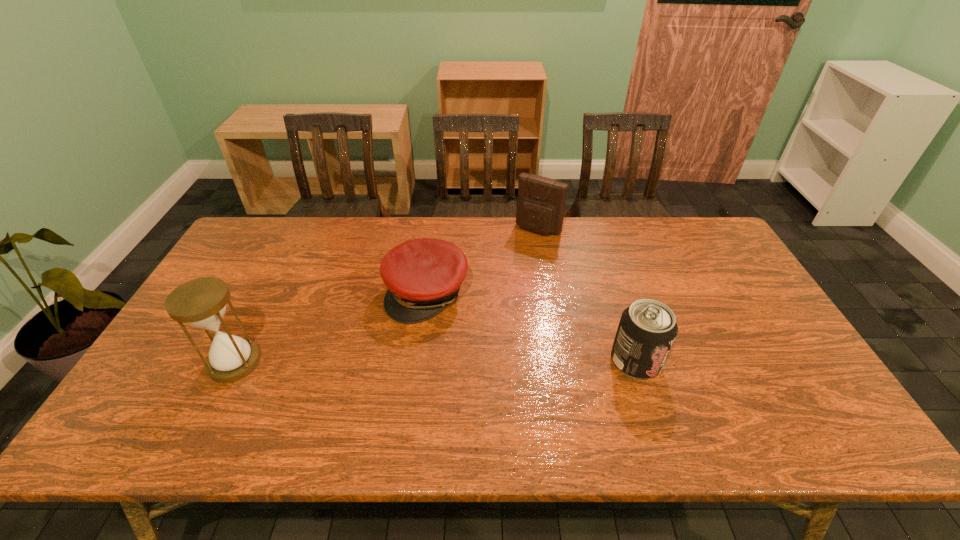
This screenshot has width=960, height=540. What are the coordinates of `vacant area that lies between the soda can and the tallest object` in the screenshot? It's located at (435, 362).

Where is `vacant region between the soda can and the second farthest object`? Image resolution: width=960 pixels, height=540 pixels. vacant region between the soda can and the second farthest object is located at coordinates (532, 327).

This screenshot has height=540, width=960. What are the coordinates of `free area in between the cap and the pouch` in the screenshot? It's located at (483, 261).

Identify which object is the third closest to the third tallest object. Please provide its 2D coordinates. Your answer should be formatted as a tuple, i.e. [(x, y)], where the tuple contains the x and y coordinates of a point satisfying the conditions above.

[(201, 302)]

Identify which object is the third closest to the tallest object. Please provide its 2D coordinates. Your answer should be formatted as a tuple, i.e. [(x, y)], where the tuple contains the x and y coordinates of a point satisfying the conditions above.

[(647, 329)]

What are the coordinates of `free spot that satisfies the following two spatial constraints: 1. on the front side of the second shortest object; 2. on the left side of the farthest object` in the screenshot? It's located at (560, 361).

The height and width of the screenshot is (540, 960). In order to click on vacant space that satisfies the following two spatial constraints: 1. on the front side of the farthest object; 2. on the right side of the soda can in this screenshot , I will do `click(560, 361)`.